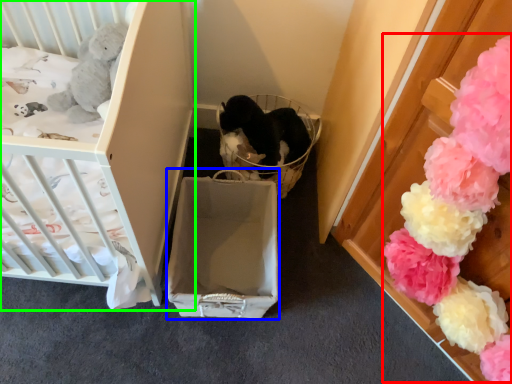
Question: Estimate the real-world distances between objects in this image. Which object is farther from flower (highlighted by a red box), cardboard box (highlighted by a blue box) or infant bed (highlighted by a green box)?

Choices:
 (A) cardboard box
 (B) infant bed

Answer: (B)